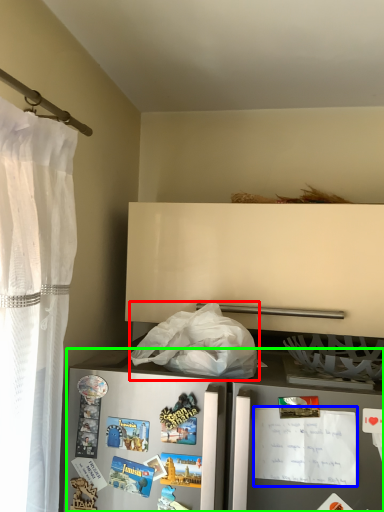
Question: Which is farther away from plastic bag (highlighted by a red box)? postcard (highlighted by a blue box) or refrigerator (highlighted by a green box)?

Choices:
 (A) postcard
 (B) refrigerator

Answer: (A)